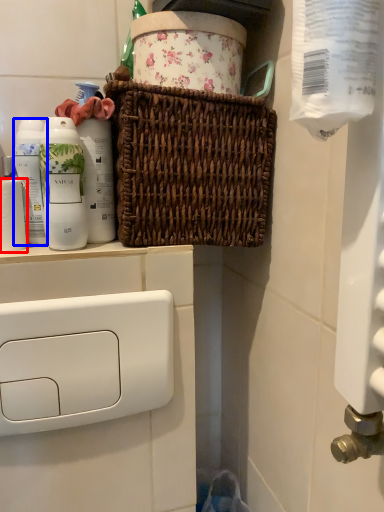
Question: Which object appears farthest to the camera in this image, toilet paper (highlighted by a red box) or mouthwash (highlighted by a blue box)?

Choices:
 (A) toilet paper
 (B) mouthwash

Answer: (B)